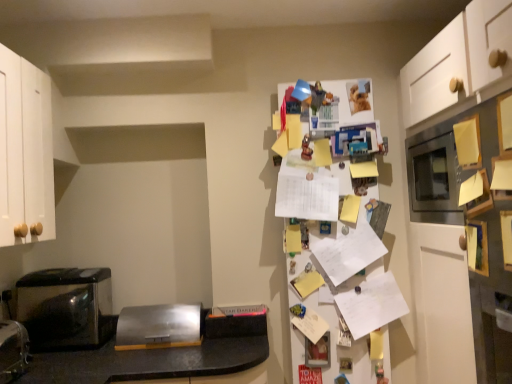
Question: Is metallic black toaster at left positioned behind white paper covered fridge at upper right?

Choices:
 (A) yes
 (B) no

Answer: (B)

Question: From a real-world perspective, is metallic black toaster at left below white paper covered fridge at upper right?

Choices:
 (A) yes
 (B) no

Answer: (A)

Question: From a real-world perspective, is metallic black toaster at left positioned over white paper covered fridge at upper right based on gravity?

Choices:
 (A) yes
 (B) no

Answer: (B)

Question: Does metallic black toaster at left have a greater width compared to white paper covered fridge at upper right?

Choices:
 (A) no
 (B) yes

Answer: (B)

Question: Is metallic black toaster at left shorter than white paper covered fridge at upper right?

Choices:
 (A) yes
 (B) no

Answer: (A)

Question: Can you confirm if metallic black toaster at left is taller than white paper covered fridge at upper right?

Choices:
 (A) yes
 (B) no

Answer: (B)

Question: Considering the relative sizes of white paper at center and white paper covered fridge at upper right in the image provided, is white paper at center wider than white paper covered fridge at upper right?

Choices:
 (A) no
 (B) yes

Answer: (A)

Question: Is white paper at center bigger than white paper covered fridge at upper right?

Choices:
 (A) no
 (B) yes

Answer: (A)

Question: Would you say white paper at center contains white paper covered fridge at upper right?

Choices:
 (A) no
 (B) yes

Answer: (A)

Question: From a real-world perspective, does white paper at center stand above white paper covered fridge at upper right?

Choices:
 (A) no
 (B) yes

Answer: (A)

Question: Would you say white paper at center is a long distance from white paper covered fridge at upper right?

Choices:
 (A) no
 (B) yes

Answer: (A)

Question: Is white paper at center looking in the opposite direction of white paper covered fridge at upper right?

Choices:
 (A) yes
 (B) no

Answer: (A)

Question: Does white paper covered fridge at upper right appear on the right side of satin silver toaster at center, which appears as the first appliance when viewed from the back?

Choices:
 (A) yes
 (B) no

Answer: (A)